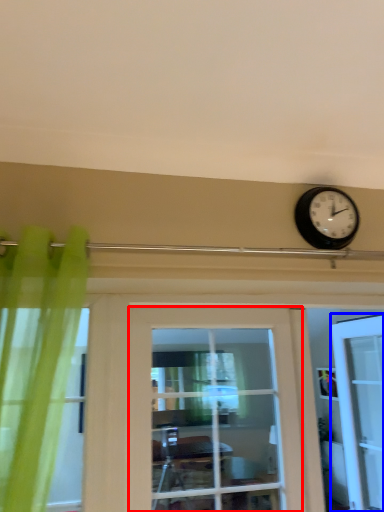
Question: Which of the following is the farthest to the observer, door (highlighted by a red box) or door (highlighted by a blue box)?

Choices:
 (A) door
 (B) door

Answer: (B)